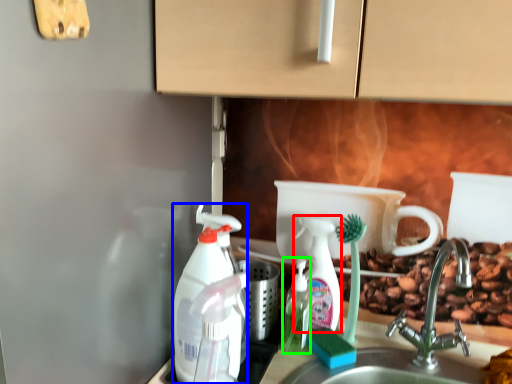
Question: Which object is positioned closest to cleaning product (highlighted by a red box)? Select from cleaning product (highlighted by a blue box) and bottle (highlighted by a green box).

Choices:
 (A) cleaning product
 (B) bottle

Answer: (B)